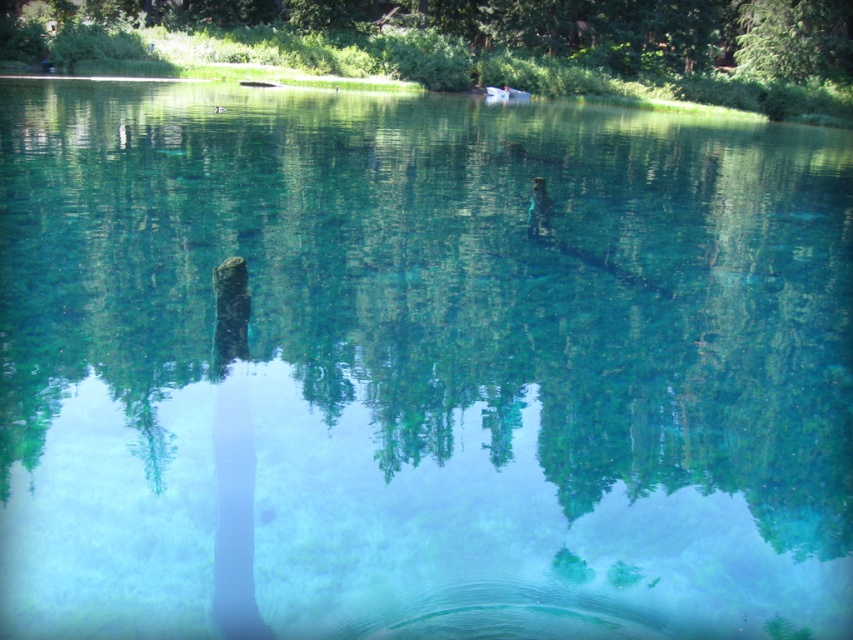
What do you see at coordinates (233, 458) in the screenshot? I see `black matte tree trunk at center` at bounding box center [233, 458].

Which is above, black matte tree trunk at center or green leafy tree at upper right?

Positioned higher is green leafy tree at upper right.

Between point (225, 296) and point (775, 49), which one is positioned behind?

Positioned behind is point (775, 49).

Where is `black matte tree trunk at center`? black matte tree trunk at center is located at coordinates (233, 458).

Does green matte tree at upper center come behind green leafy tree at upper right?

That is False.

Is point (614, 92) in front of point (802, 3)?

Yes, it is in front of point (802, 3).

Find the location of a particular element. The height and width of the screenshot is (640, 853). green matte tree at upper center is located at coordinates (485, 44).

Is point (430, 49) positioned behind point (234, 620)?

Yes, point (430, 49) is farther from viewer.

Who is more forward, [351,0] or [213,600]?

Positioned in front is point [213,600].

Which is in front, point (788, 36) or point (250, 618)?

Point (250, 618) is more forward.

The image size is (853, 640). In order to click on green matte tree at upper center in this screenshot , I will do `click(485, 44)`.